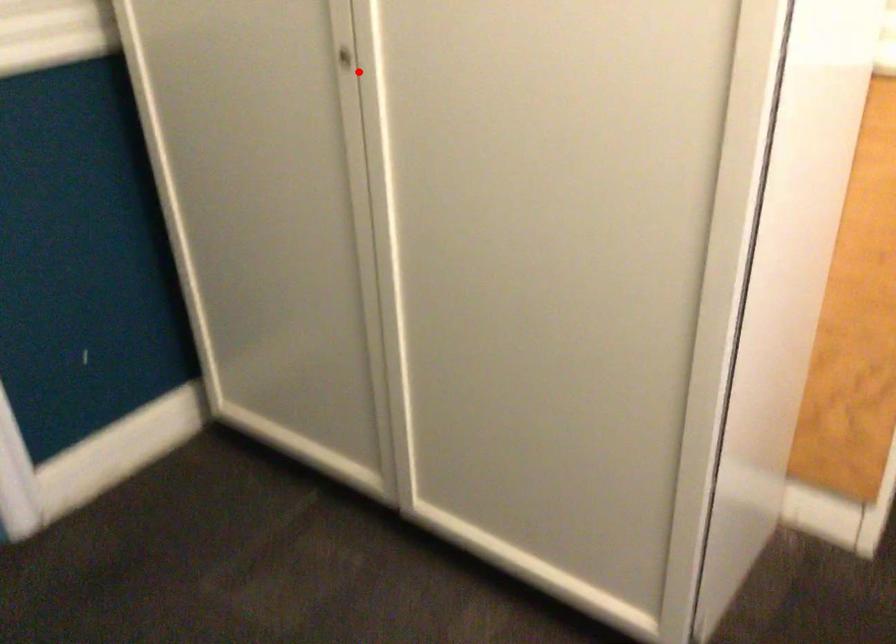
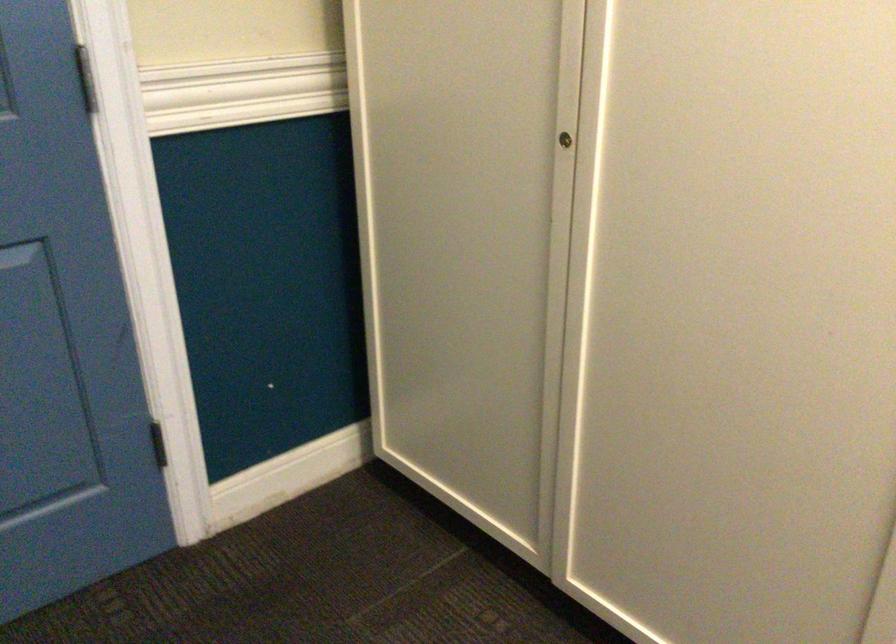
Find the pixel in the second image that matches the highlighted location in the first image.

(566, 137)